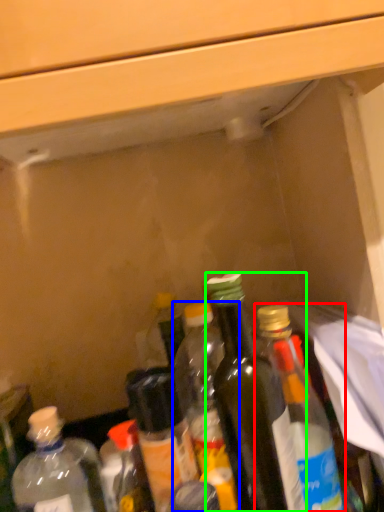
Question: Which is nearer to the bottle (highlighted by a red box)? bottle (highlighted by a blue box) or bottle (highlighted by a green box).

Choices:
 (A) bottle
 (B) bottle

Answer: (B)